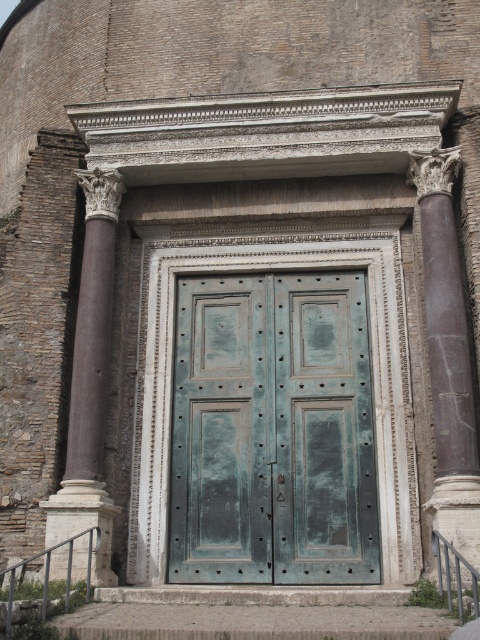
Question: Does brown marble column at right have a greater width compared to brown marble column at left?

Choices:
 (A) no
 (B) yes

Answer: (A)

Question: Does brown marble column at right appear under brown marble column at left?

Choices:
 (A) yes
 (B) no

Answer: (B)

Question: Which of the following is the closest to the observer?

Choices:
 (A) brown marble column at right
 (B) brown marble column at left

Answer: (A)

Question: Does brown marble column at right appear on the left side of brown marble column at left?

Choices:
 (A) no
 (B) yes

Answer: (A)

Question: Which point appears closest to the camera in this image?

Choices:
 (A) (447, 250)
 (B) (94, 417)

Answer: (B)

Question: Which point appears closest to the camera in this image?

Choices:
 (A) (115, 212)
 (B) (444, 240)

Answer: (B)